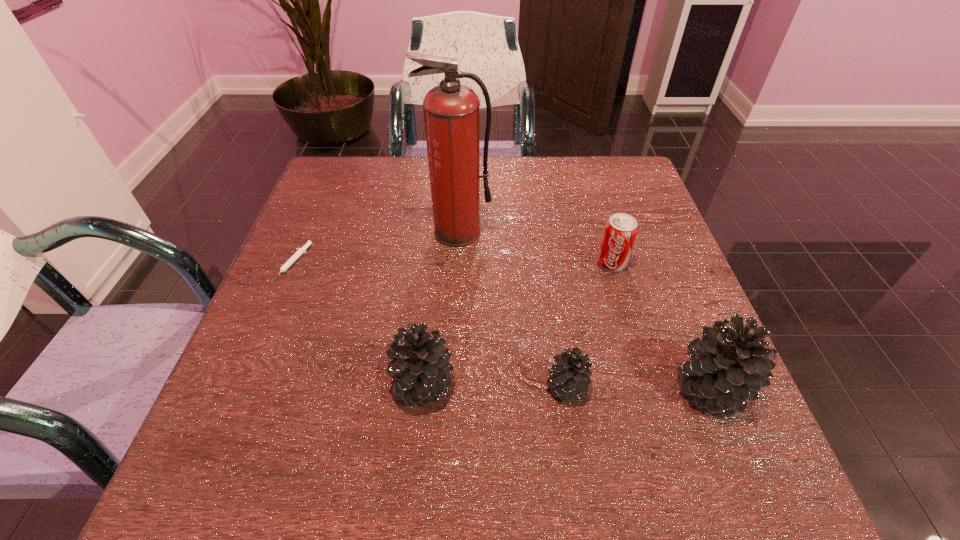
Locate an element on the screen. vacant space situated on the back of the leftmost pinecone is located at coordinates pos(428,327).

Locate an element on the screen. The width and height of the screenshot is (960, 540). free point located 0.050m on the back of the third object from right to left is located at coordinates (560, 345).

What are the coordinates of `free point located on the back of the rightmost object` in the screenshot? It's located at (677, 304).

Locate an element on the screen. The height and width of the screenshot is (540, 960). blank space located at the nozzle of the tallest object is located at coordinates (453, 333).

Locate an element on the screen. The width and height of the screenshot is (960, 540). free spot located on the right of the syringe is located at coordinates coord(411,264).

You are a GUI agent. You are given a task and a screenshot of the screen. Output one action in this format:
    pyautogui.click(x=<x>, y=<y>)
    Task: Click on the vacant space located on the left of the fifth object from left to right
    The image size is (960, 540).
    Given the screenshot: What is the action you would take?
    522,263

Image resolution: width=960 pixels, height=540 pixels. In order to click on object that is at the left edge in this screenshot , I will do `click(300, 251)`.

The height and width of the screenshot is (540, 960). Identify the location of pinecone located in the right edge section of the desktop. (729, 365).

I want to click on soda can that is at the right edge, so click(x=620, y=231).

Locate an element on the screen. The image size is (960, 540). object that is at the near right corner is located at coordinates (729, 365).